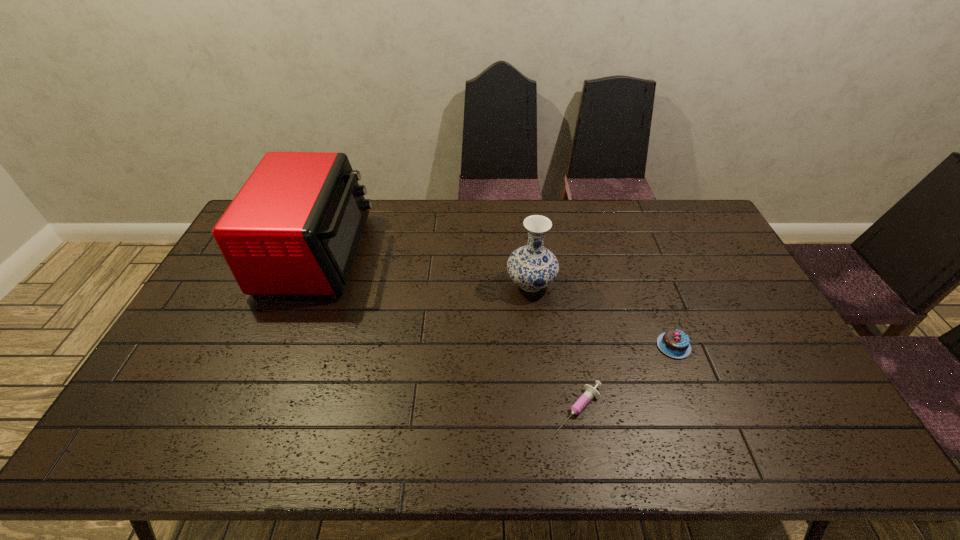
Where is `toaster oven`? This screenshot has width=960, height=540. toaster oven is located at coordinates click(x=294, y=228).

I want to click on vase, so click(x=532, y=267).

What are the coordinates of `the rightmost object` in the screenshot? It's located at (675, 343).

The image size is (960, 540). I want to click on chocolate cake, so click(x=675, y=343).

Where is `syringe`? Image resolution: width=960 pixels, height=540 pixels. syringe is located at coordinates (591, 392).

Locate an element on the screen. The image size is (960, 540). the shortest object is located at coordinates (591, 392).

Image resolution: width=960 pixels, height=540 pixels. Identify the location of free space located 0.230m on the front-facing side of the leftmost object. (434, 255).

Where is `free location located on the front of the vase`? free location located on the front of the vase is located at coordinates (545, 404).

What are the coordinates of `vacant point located 0.070m on the left of the third farthest object` in the screenshot? It's located at (632, 346).

Locate an element on the screen. free region located 0.160m on the left of the syringe is located at coordinates (489, 408).